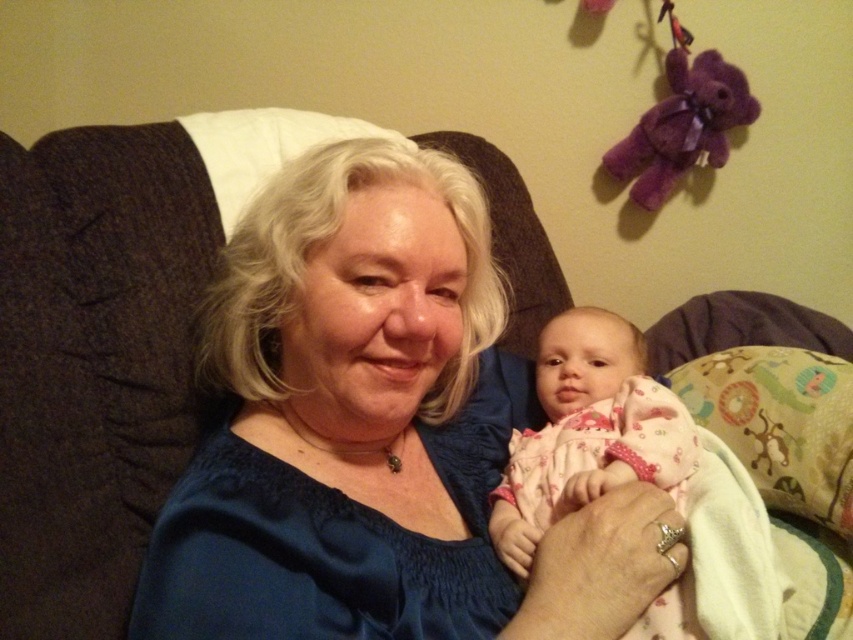
Question: Can you confirm if blue satin blouse at center is smaller than pink cotton baby at center?

Choices:
 (A) yes
 (B) no

Answer: (B)

Question: Which of the following is the closest to the observer?

Choices:
 (A) (459, 253)
 (B) (573, 333)

Answer: (A)

Question: Is blue satin blouse at center bigger than pink cotton baby at center?

Choices:
 (A) yes
 (B) no

Answer: (A)

Question: Which point is farther from the camera taking this photo?

Choices:
 (A) (523, 593)
 (B) (637, 412)

Answer: (B)

Question: Does blue satin blouse at center appear over pink cotton baby at center?

Choices:
 (A) no
 (B) yes

Answer: (B)

Question: Which point is closer to the camera?

Choices:
 (A) pink cotton baby at center
 (B) blue satin blouse at center

Answer: (B)